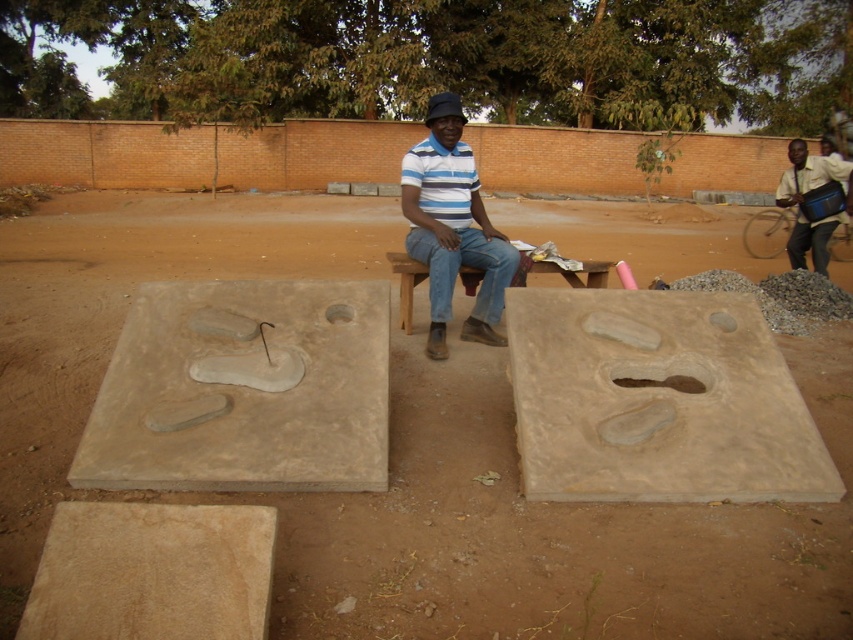
Based on the coordinates provided in the scene description, where is the beige concrete slab at center located?

The beige concrete slab at center is located at point (244, 388).

You are standing at the edge of the dirt ground and want to place a new object between the brown concrete slab at center and the light brown leather bag at right. Is there enough space to place it there?

The brown concrete slab at center is in front of the light brown leather bag at right, so there is space between them to place a new object.